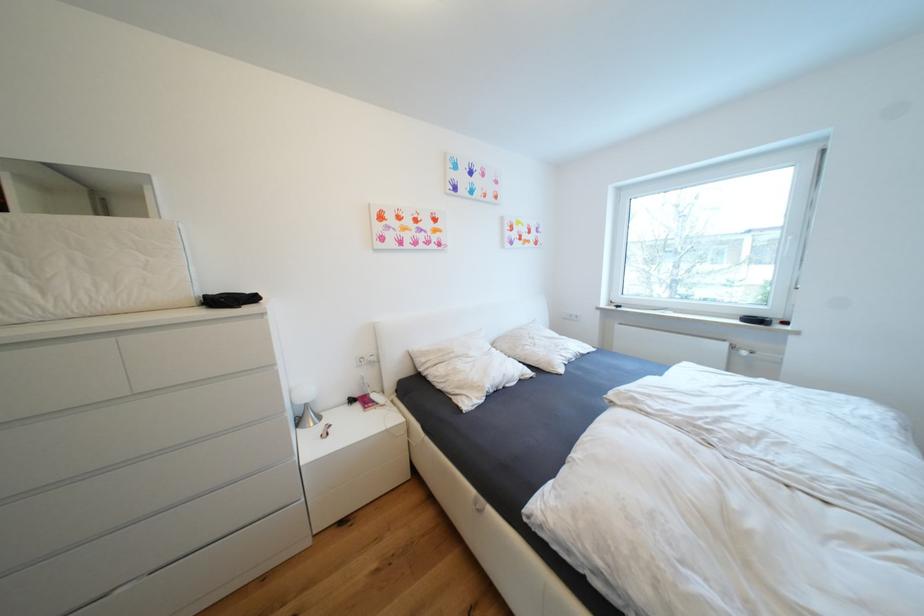
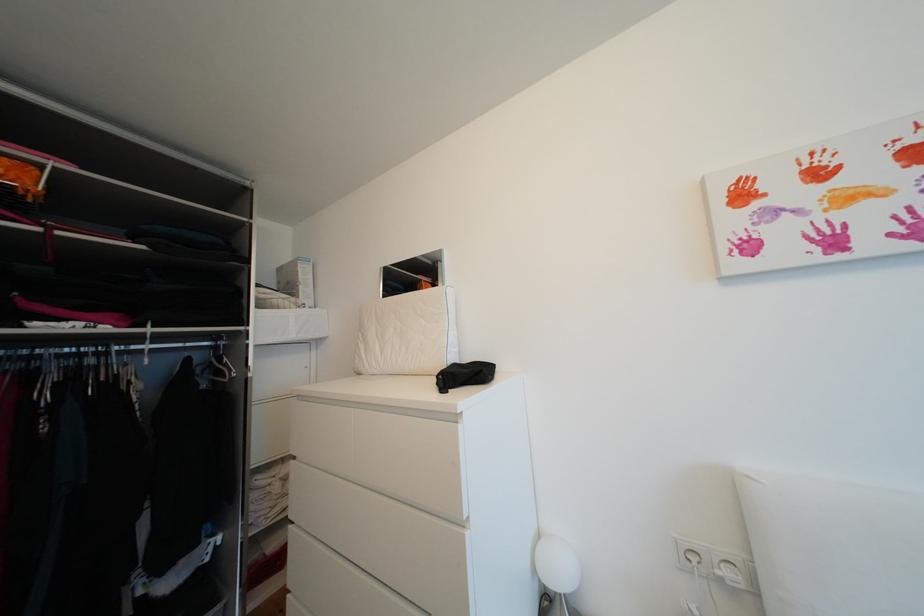
Question: Based on the continuous images, in which direction is the camera rotating? Reply with the corresponding letter.

Choices:
 (A) Left
 (B) Right
 (C) Up
 (D) Down

Answer: (A)